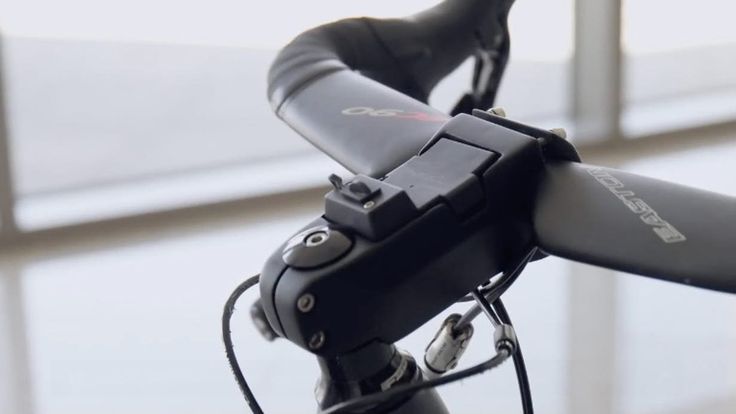
Where is `floor`? Image resolution: width=736 pixels, height=414 pixels. floor is located at coordinates (612, 346).